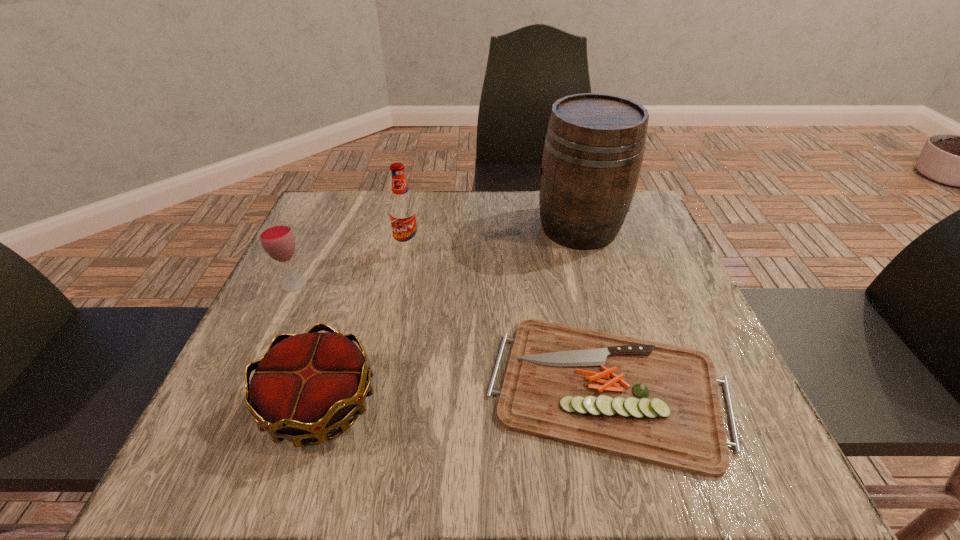
Locate an element on the screen. The image size is (960, 540). cider is located at coordinates (594, 145).

Where is `the second tallest object`? the second tallest object is located at coordinates (403, 214).

Where is `the third tallest object`? This screenshot has width=960, height=540. the third tallest object is located at coordinates (277, 238).

Find the location of a particular element. The width and height of the screenshot is (960, 540). wineglass is located at coordinates (277, 238).

In order to click on the second shortest object in this screenshot , I will do `click(306, 385)`.

Identify the location of chopping board. The height and width of the screenshot is (540, 960). (657, 403).

I want to click on free space located on the side of the tallest object near the bung hole, so click(394, 227).

Image resolution: width=960 pixels, height=540 pixels. I want to click on vacant space located 0.370m on the side of the tallest object near the bung hole, so click(x=390, y=227).

The height and width of the screenshot is (540, 960). Identify the location of free space located 0.250m on the side of the tallest object near the bung hole. (437, 227).

Find the location of `free space located on the front of the fourth shortest object`. free space located on the front of the fourth shortest object is located at coordinates (404, 271).